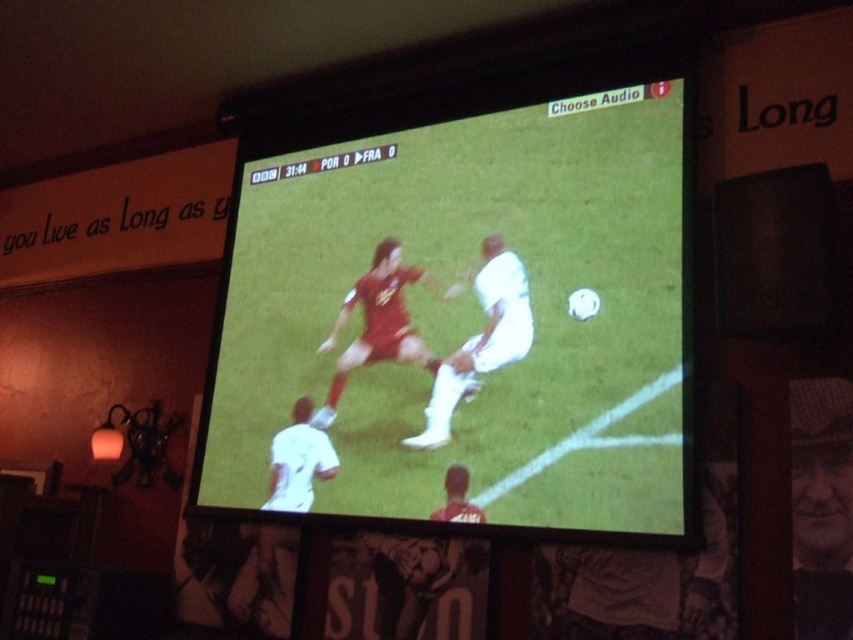
Can you confirm if white matte soccer player at center is positioned to the right of white matte jersey at lower left?

Correct, you'll find white matte soccer player at center to the right of white matte jersey at lower left.

Between point (489, 243) and point (297, 436), which one is positioned behind?

Positioned behind is point (297, 436).

What are the coordinates of `white matte soccer player at center` in the screenshot? It's located at (480, 339).

Which is more to the left, matte white soccer ball at center or white matte jersey at lower left?

Positioned to the left is white matte jersey at lower left.

Which is below, matte white soccer ball at center or white matte jersey at lower left?

white matte jersey at lower left is lower down.

Find the location of `matte white soccer ball at center`. matte white soccer ball at center is located at coordinates (467, 310).

Is point (312, 228) positioned before point (821, 538)?

No.

Does matte white soccer ball at center have a greater height compared to smooth leather hat at upper right?

Indeed, matte white soccer ball at center has a greater height compared to smooth leather hat at upper right.

Does point (218, 442) lie in front of point (807, 548)?

That is False.

This screenshot has width=853, height=640. In order to click on matte white soccer ball at center in this screenshot , I will do `click(467, 310)`.